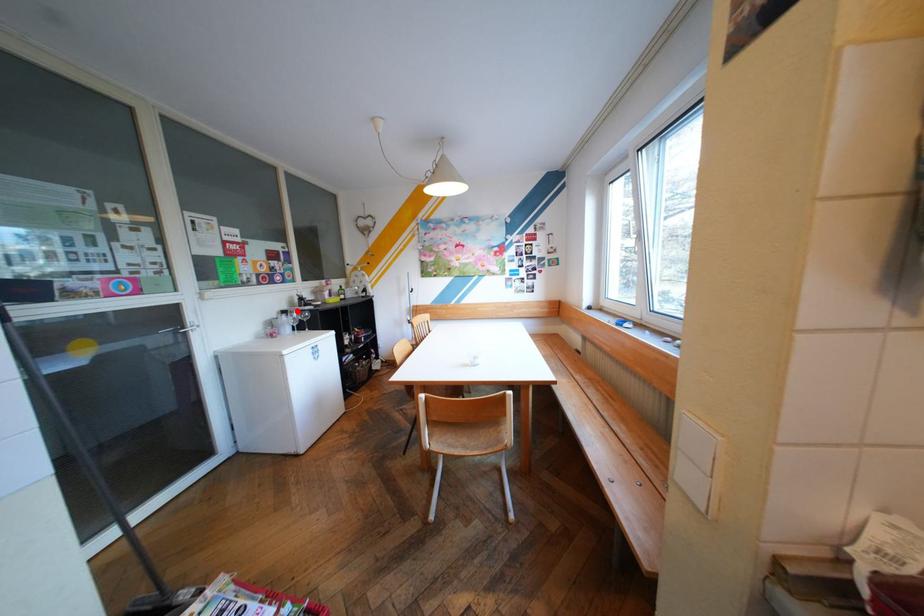
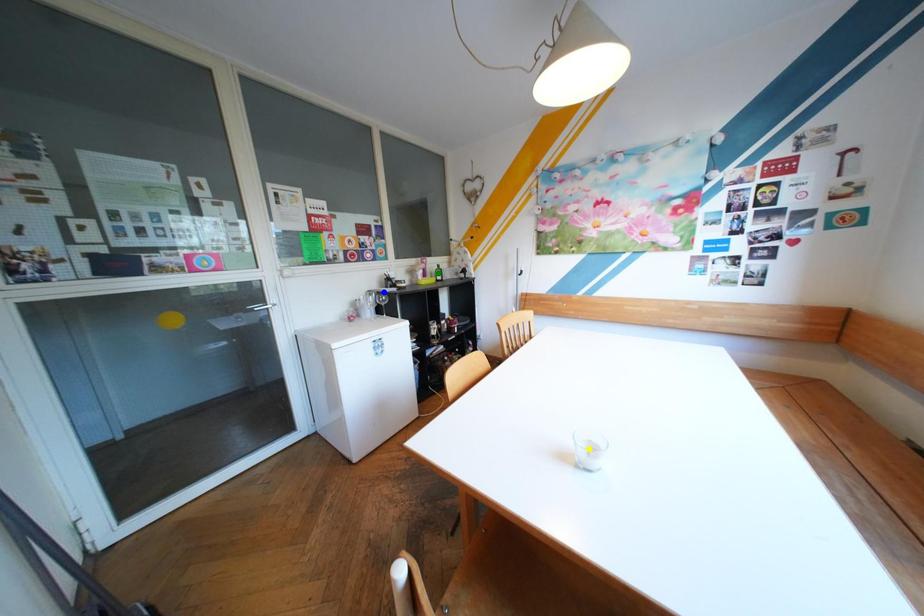
Question: I am providing you with two images of the same scene from different viewpoints. A red point is marked on the first image. You are given multiple points on the second image. In image 2, which mark is for the same physical point as the one in image 1?

Choices:
 (A) green point
 (B) blue point
 (C) yellow point

Answer: (B)